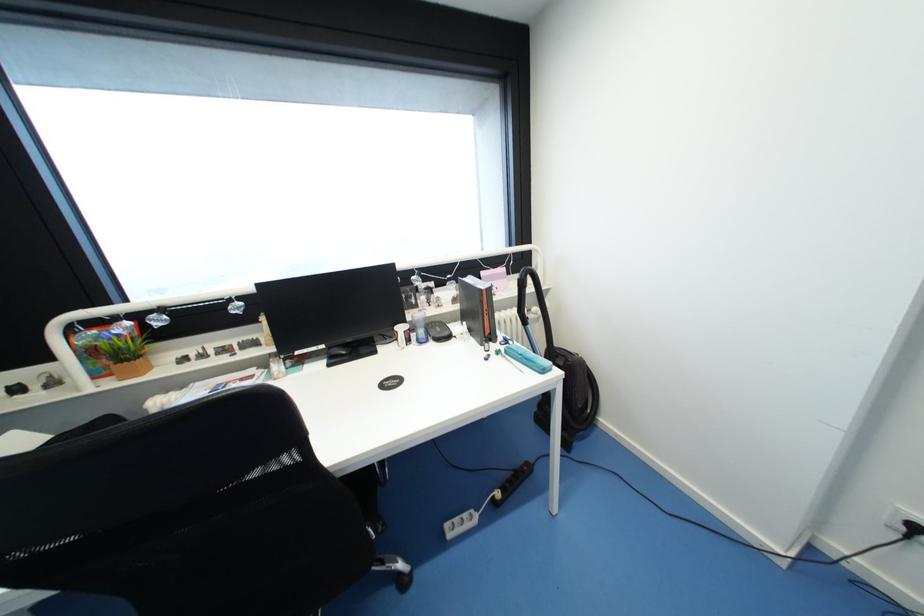
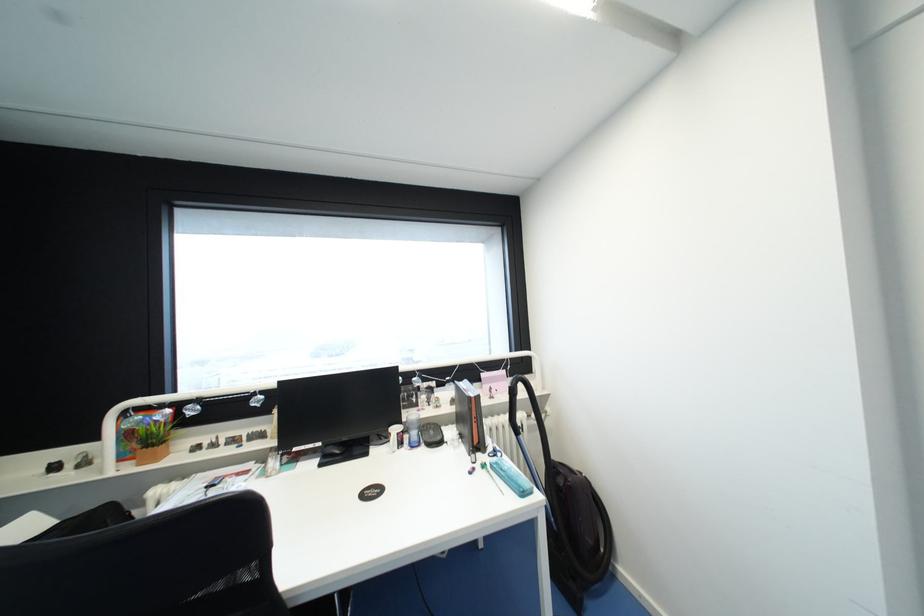
Find the pixel in the second image that matches point 327,347 in the first image.

(323, 445)